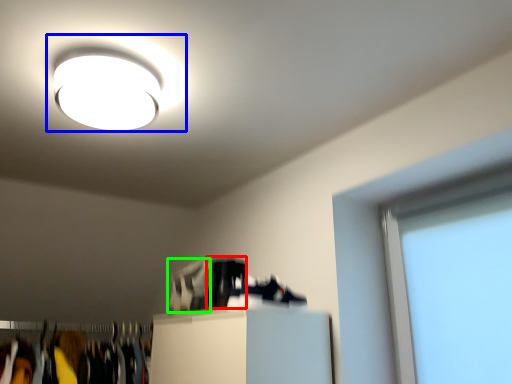
Question: Which object is the closest to the shoe (highlighted by a red box)? Choose among these: lamp (highlighted by a blue box) or shoe (highlighted by a green box).

Choices:
 (A) lamp
 (B) shoe

Answer: (B)